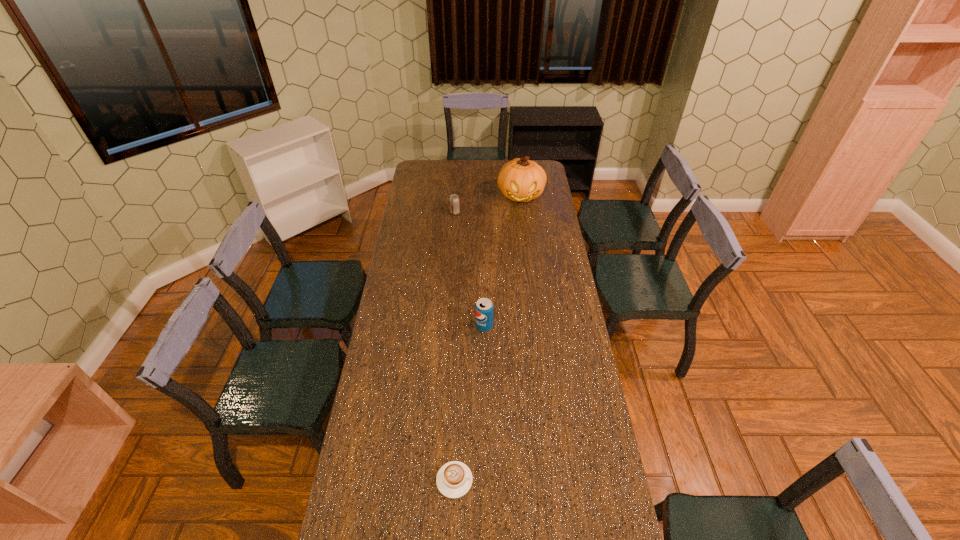
Find the location of `the tallest object`. the tallest object is located at coordinates point(521,180).

Find the location of a particular element. Image resolution: width=960 pixels, height=540 pixels. pumpkin is located at coordinates (521, 180).

What are the coordinates of `the second tallest object` in the screenshot? It's located at (484, 309).

At what (x,y) coordinates should I click in order to perform the action: click on the right soda can. Please return your answer as a coordinate pair (x, y). The height and width of the screenshot is (540, 960). Looking at the image, I should click on (484, 309).

Locate an element on the screen. The width and height of the screenshot is (960, 540). the shorter soda can is located at coordinates (454, 200).

At what (x,y) coordinates should I click in order to perform the action: click on the second farthest object. Please return your answer as a coordinate pair (x, y). Looking at the image, I should click on (454, 200).

Where is `the nearest object`? The height and width of the screenshot is (540, 960). the nearest object is located at coordinates (454, 479).

Find the location of a particular element. This screenshot has width=960, height=540. cappuccino is located at coordinates (454, 479).

Locate an element on the screen. This screenshot has width=960, height=540. vacant position located 0.170m on the front face of the farthest object is located at coordinates (525, 228).

Identify the location of vacant space located 0.220m on the front of the nearer soda can. The height and width of the screenshot is (540, 960). (485, 378).